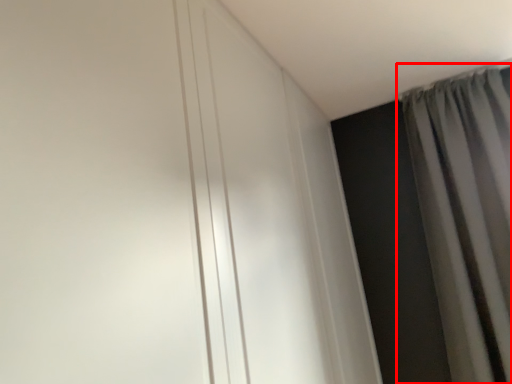
Question: From the image's perspective, where is curtain (annotated by the red box) located in relation to door in the image?

Choices:
 (A) above
 (B) below

Answer: (B)